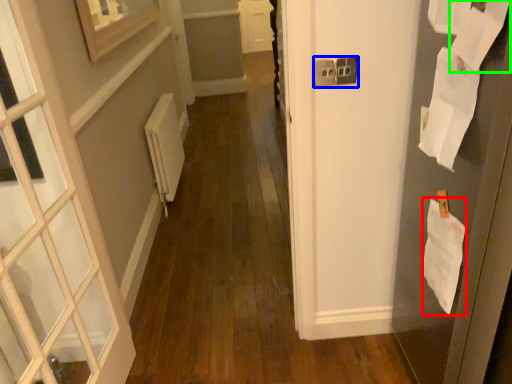
Question: Which object is the farthest from paper (highlighted by a red box)? Choose among these: electric outlet (highlighted by a blue box) or paper (highlighted by a green box).

Choices:
 (A) electric outlet
 (B) paper

Answer: (A)